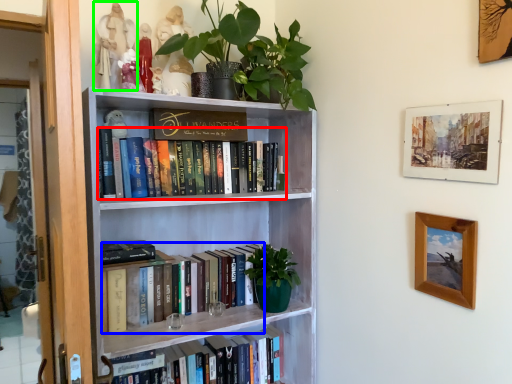
Question: Which is farther away from book (highlighted by a red box)? book (highlighted by a blue box) or toy (highlighted by a green box)?

Choices:
 (A) book
 (B) toy

Answer: (B)